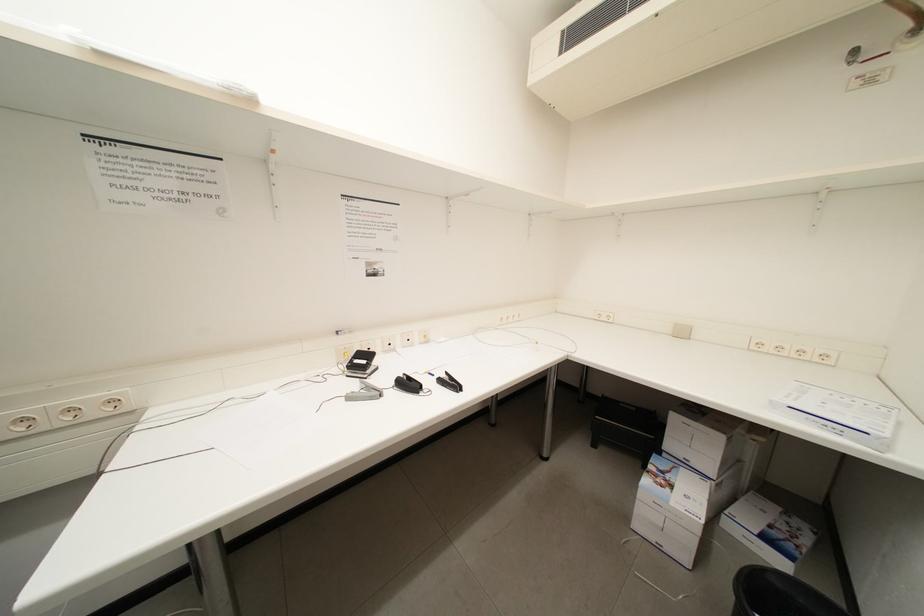
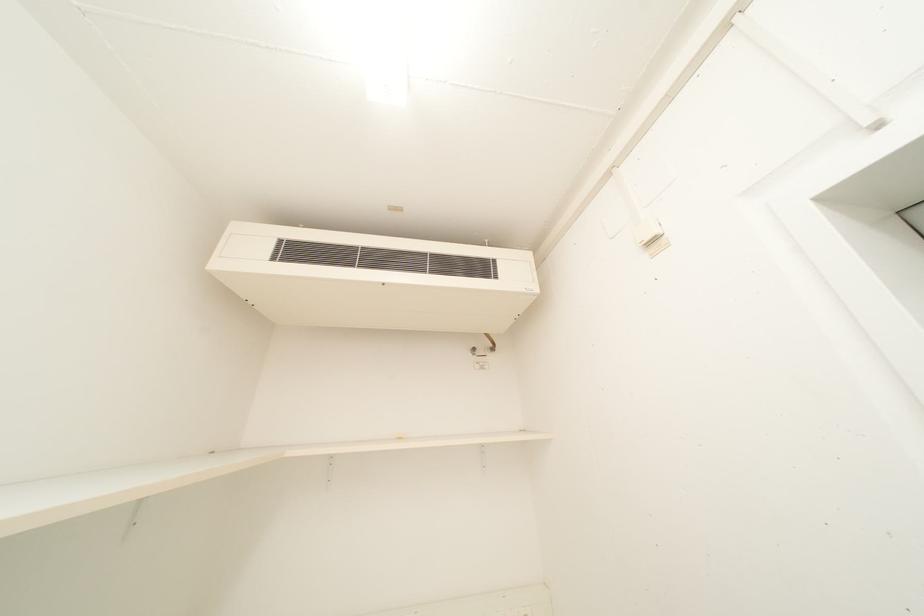
The first image is from the beginning of the video and the second image is from the end. How did the camera likely rotate when shooting the video?

The rotation direction of the camera is right-up.